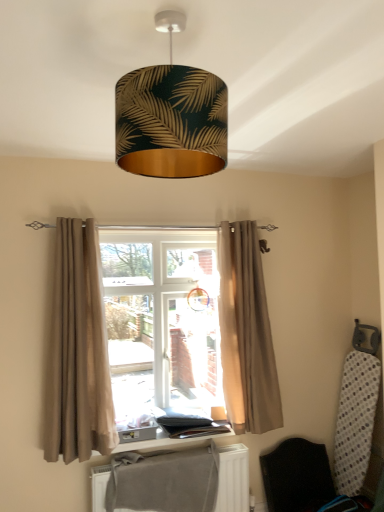
Question: Is black fabric folding chair at lower right further to camera compared to gold leaf-patterned lampshade at upper center?

Choices:
 (A) no
 (B) yes

Answer: (B)

Question: Are black fabric folding chair at lower right and gold leaf-patterned lampshade at upper center located far from each other?

Choices:
 (A) yes
 (B) no

Answer: (A)

Question: Is black fabric folding chair at lower right wider than gold leaf-patterned lampshade at upper center?

Choices:
 (A) yes
 (B) no

Answer: (B)

Question: Is the position of black fabric folding chair at lower right less distant than that of gold leaf-patterned lampshade at upper center?

Choices:
 (A) no
 (B) yes

Answer: (A)

Question: From a real-world perspective, is black fabric folding chair at lower right on gold leaf-patterned lampshade at upper center?

Choices:
 (A) yes
 (B) no

Answer: (B)

Question: Does black fabric folding chair at lower right have a lesser height compared to gold leaf-patterned lampshade at upper center?

Choices:
 (A) yes
 (B) no

Answer: (B)

Question: Is wooden window sill at center at the back of black fabric folding chair at lower right?

Choices:
 (A) no
 (B) yes

Answer: (A)

Question: Is black fabric folding chair at lower right outside of wooden window sill at center?

Choices:
 (A) no
 (B) yes

Answer: (B)

Question: From the image's perspective, does black fabric folding chair at lower right appear lower than wooden window sill at center?

Choices:
 (A) no
 (B) yes

Answer: (B)

Question: Can you confirm if black fabric folding chair at lower right is bigger than wooden window sill at center?

Choices:
 (A) no
 (B) yes

Answer: (B)

Question: Is black fabric folding chair at lower right not near wooden window sill at center?

Choices:
 (A) no
 (B) yes

Answer: (A)

Question: Is black fabric folding chair at lower right to the right of wooden window sill at center from the viewer's perspective?

Choices:
 (A) yes
 (B) no

Answer: (A)

Question: Is the depth of wooden window sill at center greater than that of beige fabric curtain at center?

Choices:
 (A) no
 (B) yes

Answer: (A)